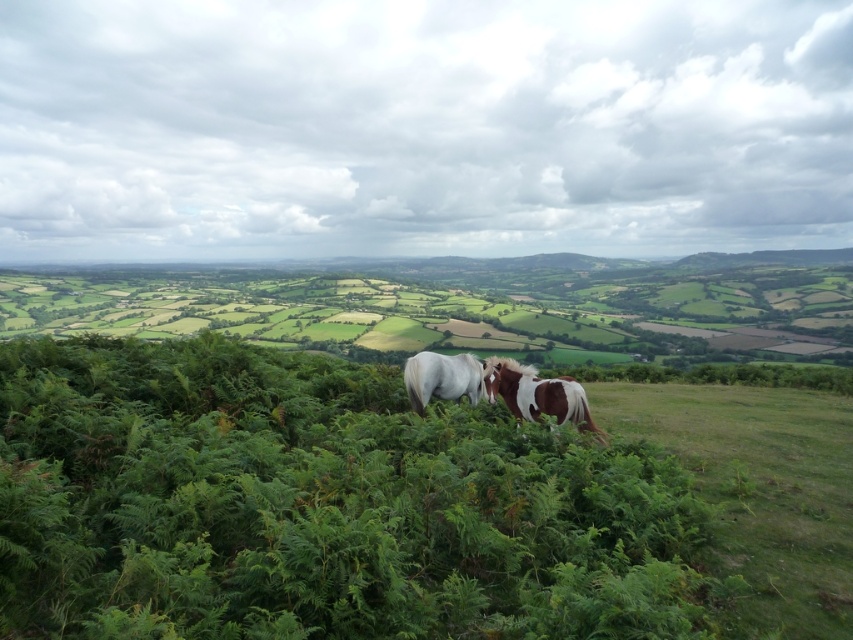
You are standing at the point marked by the coordinates point (x=318, y=506). Looking around, what object is exactly at your current position?

The green leafy shrubs at center are located at point (x=318, y=506), so the object exactly at your current position is the green leafy shrubs at center.